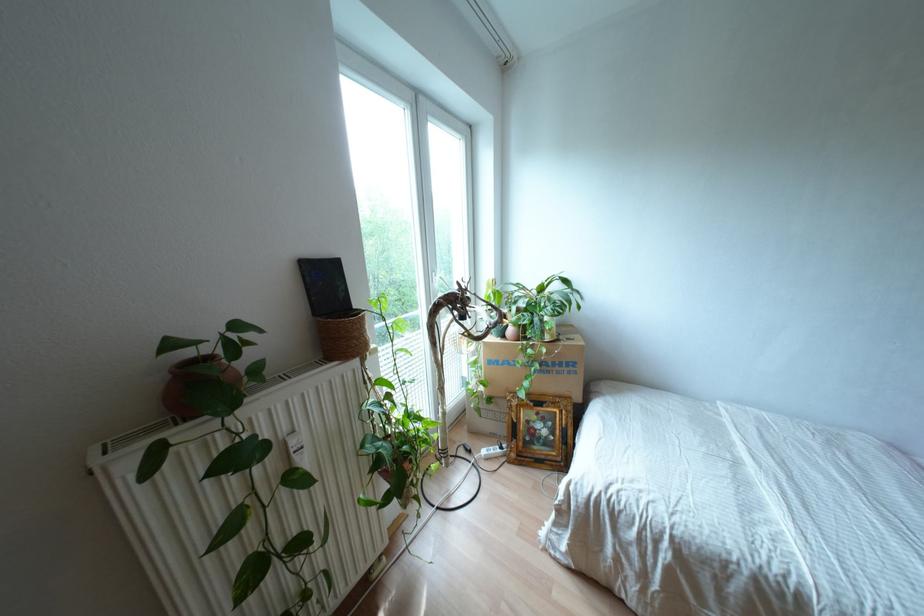
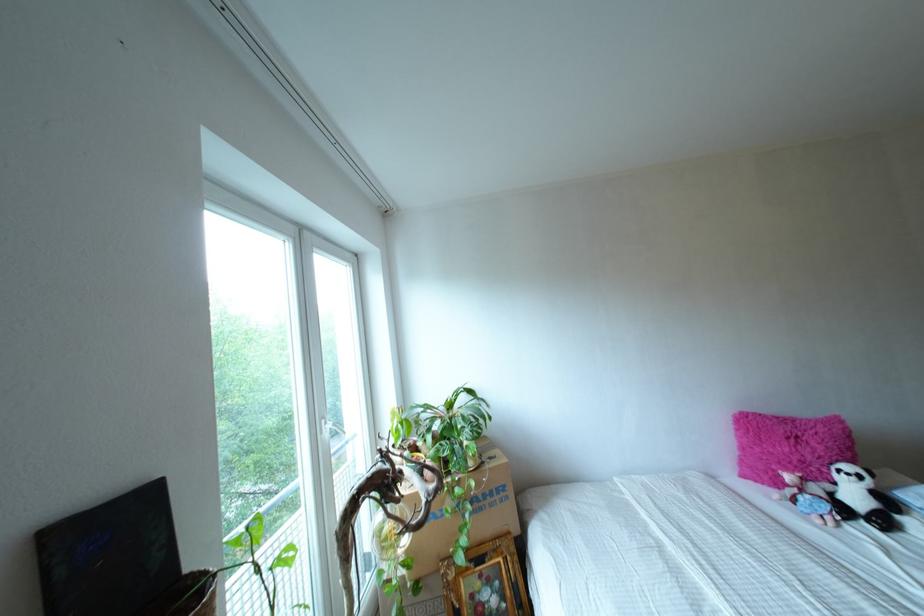
The images are taken continuously from a first-person perspective. In which direction is your viewpoint rotating?

The camera's rotation is toward right-up.